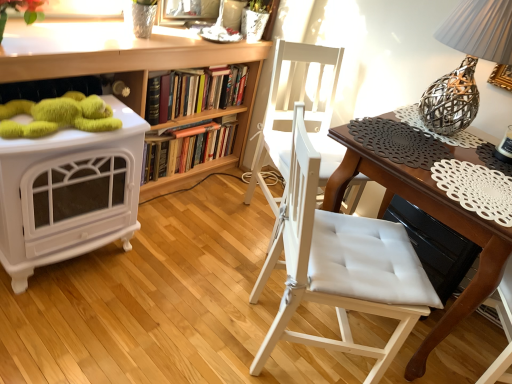
Where is `vacant area on top of white glossy fireplace at left (from a real-world perspective)`? The height and width of the screenshot is (384, 512). vacant area on top of white glossy fireplace at left (from a real-world perspective) is located at coordinates (65, 112).